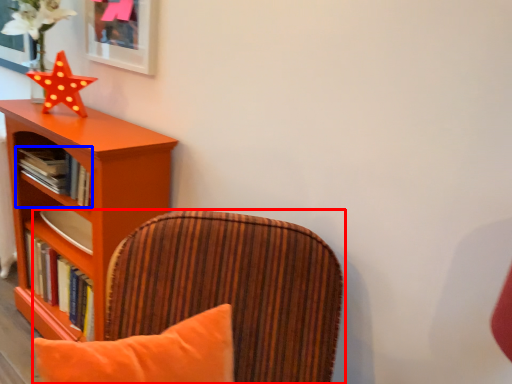
Question: Which point is closer to the camera, chair (highlighted by a red box) or book (highlighted by a blue box)?

Choices:
 (A) chair
 (B) book

Answer: (A)